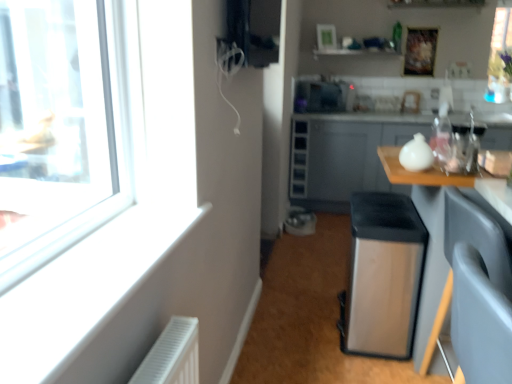
Question: From a real-world perspective, is wooden table at right below satin silver trash can at center?

Choices:
 (A) no
 (B) yes

Answer: (A)

Question: Is wooden table at right further to camera compared to satin silver trash can at center?

Choices:
 (A) yes
 (B) no

Answer: (B)

Question: Is wooden table at right thinner than satin silver trash can at center?

Choices:
 (A) yes
 (B) no

Answer: (A)

Question: Is wooden table at right facing towards satin silver trash can at center?

Choices:
 (A) yes
 (B) no

Answer: (B)

Question: Is wooden table at right far away from satin silver trash can at center?

Choices:
 (A) yes
 (B) no

Answer: (A)

Question: From the image's perspective, is transparent plastic bottle at upper right located above or below metallic gray drawer at center, placed as the 1th drawer when sorted from bottom to top?

Choices:
 (A) below
 (B) above

Answer: (A)

Question: Does point (438, 122) appear closer or farther from the camera than point (298, 145)?

Choices:
 (A) closer
 (B) farther

Answer: (A)

Question: Is transparent plastic bottle at upper right taller or shorter than metallic gray drawer at center, placed as the 1th drawer when sorted from bottom to top?

Choices:
 (A) short
 (B) tall

Answer: (B)

Question: Is transparent plastic bottle at upper right bigger or smaller than metallic gray drawer at center, placed as the 1th drawer when sorted from bottom to top?

Choices:
 (A) big
 (B) small

Answer: (B)

Question: From the image's perspective, is satin silver trash can at center positioned above or below metallic gray drawer at center, placed as the 2th drawer when sorted from top to bottom?

Choices:
 (A) above
 (B) below

Answer: (B)

Question: Would you say satin silver trash can at center is inside or outside metallic gray drawer at center, placed as the 2th drawer when sorted from top to bottom?

Choices:
 (A) inside
 (B) outside

Answer: (B)

Question: Relative to metallic gray drawer at center, placed as the 2th drawer when sorted from top to bottom, is satin silver trash can at center in front or behind?

Choices:
 (A) front
 (B) behind

Answer: (A)

Question: Visually, is satin silver trash can at center positioned to the left or to the right of metallic gray drawer at center, placed as the 2th drawer when sorted from top to bottom?

Choices:
 (A) left
 (B) right

Answer: (B)

Question: From the image's perspective, is wooden table at right located above or below transparent plastic bottle at upper right?

Choices:
 (A) below
 (B) above

Answer: (A)

Question: In terms of height, does wooden table at right look taller or shorter compared to transparent plastic bottle at upper right?

Choices:
 (A) short
 (B) tall

Answer: (B)